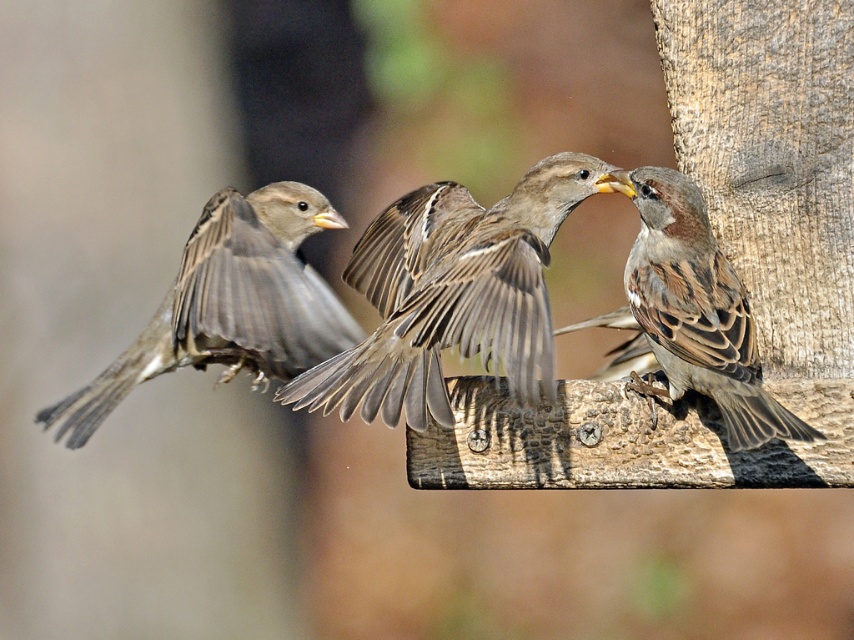
You are a photographer standing at a distance, trying to capture a close shot of the brown speckled feathers at center. Your camera has a maximum zoom range of 10 feet. Can you get a clear close shot without moving closer?

The brown speckled feathers at center is 8.49 feet from viewer, which is within the camera maximum zoom range of 10 feet. So yes, you can get a clear close shot without moving closer.